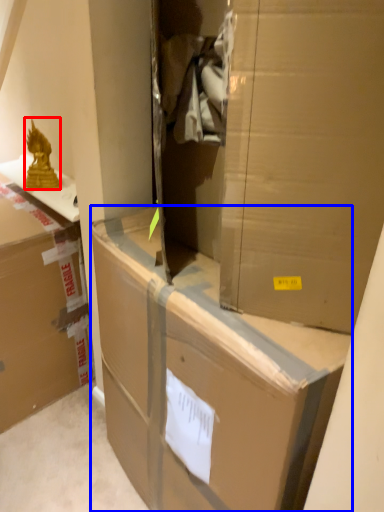
Question: Which object is further to the camera taking this photo, wrap (highlighted by a red box) or box (highlighted by a blue box)?

Choices:
 (A) wrap
 (B) box

Answer: (A)